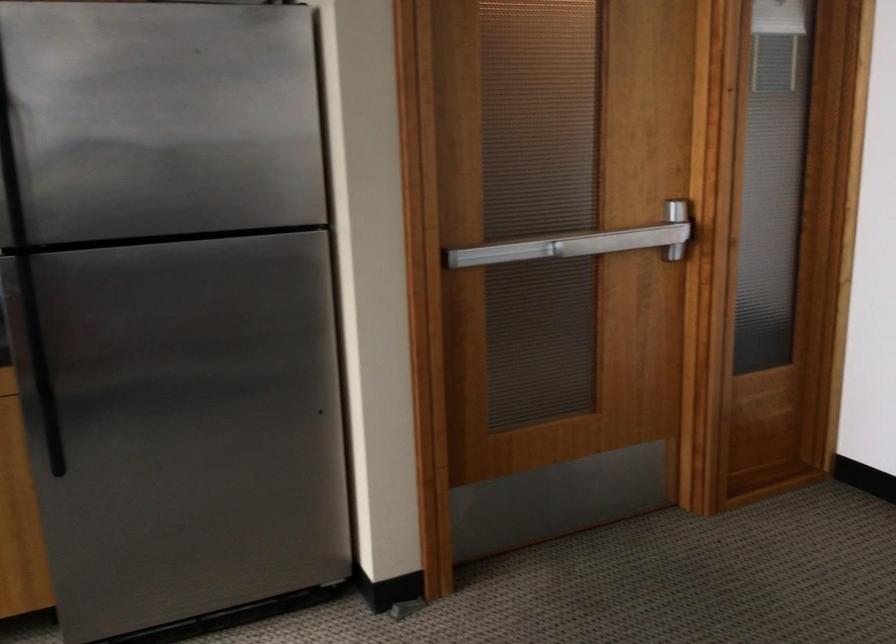
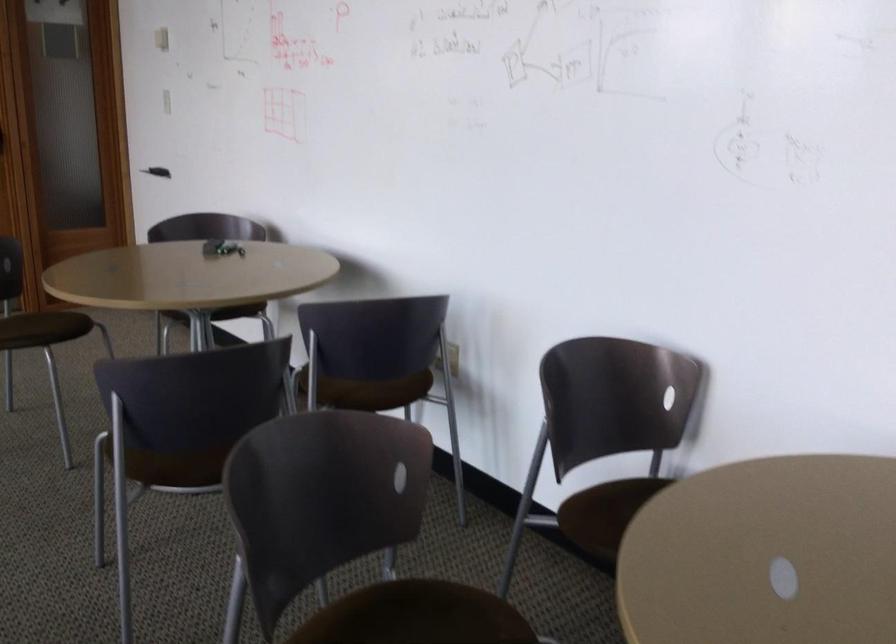
What movement of the cameraman would produce the second image?

The cameraman moved toward right, backward.